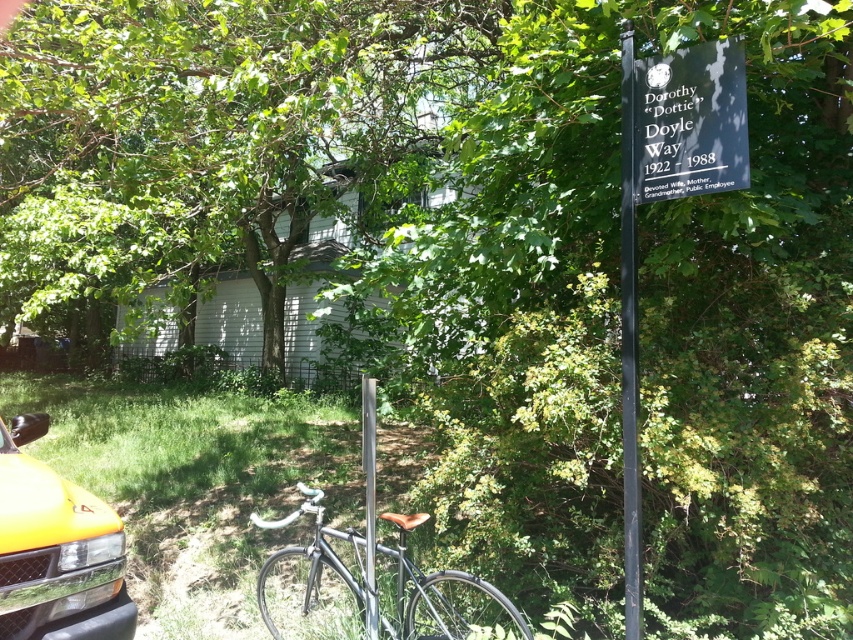
Question: Among these objects, which one is farthest from the camera?

Choices:
 (A) yellow matte car at lower left
 (B) black polished stone sign at upper right
 (C) black polished signpost at upper right
 (D) green leafy tree at upper left

Answer: (D)

Question: Is yellow matte car at lower left to the left of black metal signpost at upper right from the viewer's perspective?

Choices:
 (A) no
 (B) yes

Answer: (B)

Question: Among these points, which one is farthest from the camera?

Choices:
 (A) (634, 563)
 (B) (489, 595)
 (C) (368, 513)

Answer: (C)

Question: Can you confirm if black polished signpost at upper right is smaller than shiny black bicycle at center?

Choices:
 (A) yes
 (B) no

Answer: (A)

Question: Which object is positioned farthest from the shiny black bicycle at center?

Choices:
 (A) black polished stone sign at upper right
 (B) black polished signpost at upper right
 (C) yellow matte car at lower left

Answer: (A)

Question: Can you confirm if green leafy tree at upper left is positioned to the right of black metal signpost at upper right?

Choices:
 (A) yes
 (B) no

Answer: (B)